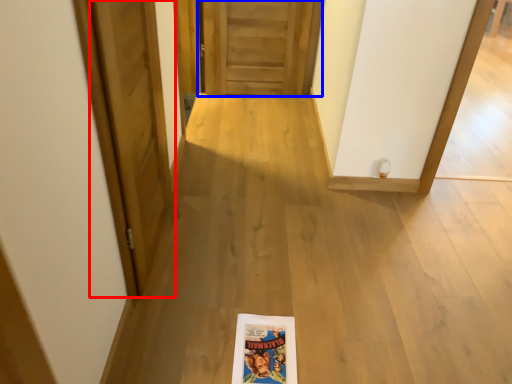
Question: Which object appears closest to the camera in this image, door (highlighted by a red box) or door (highlighted by a blue box)?

Choices:
 (A) door
 (B) door

Answer: (A)